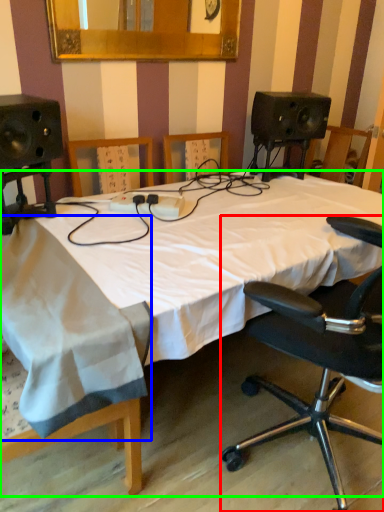
Question: Which object is positioned farthest from chair (highlighted by a red box)? Select from sheet (highlighted by a blue box) and bed (highlighted by a green box).

Choices:
 (A) sheet
 (B) bed

Answer: (A)